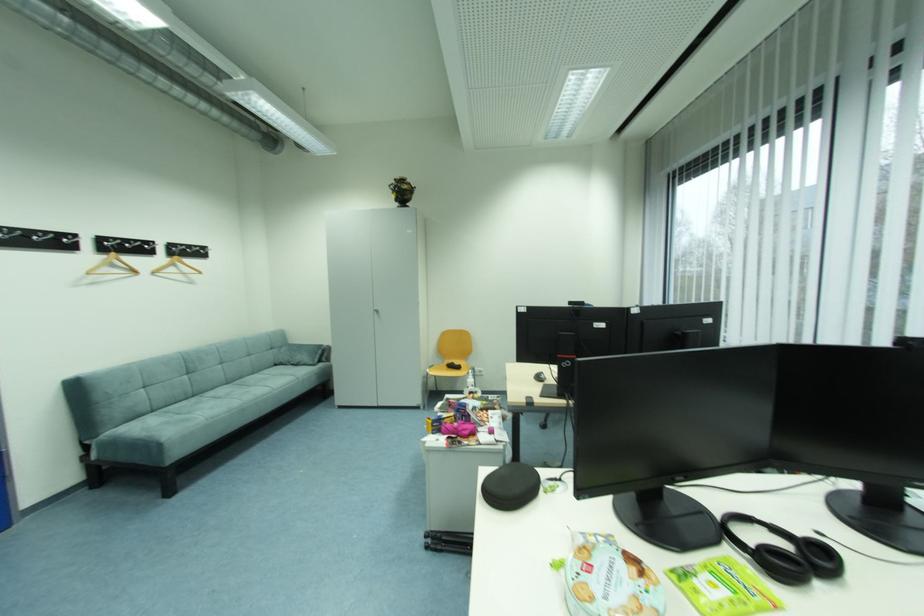
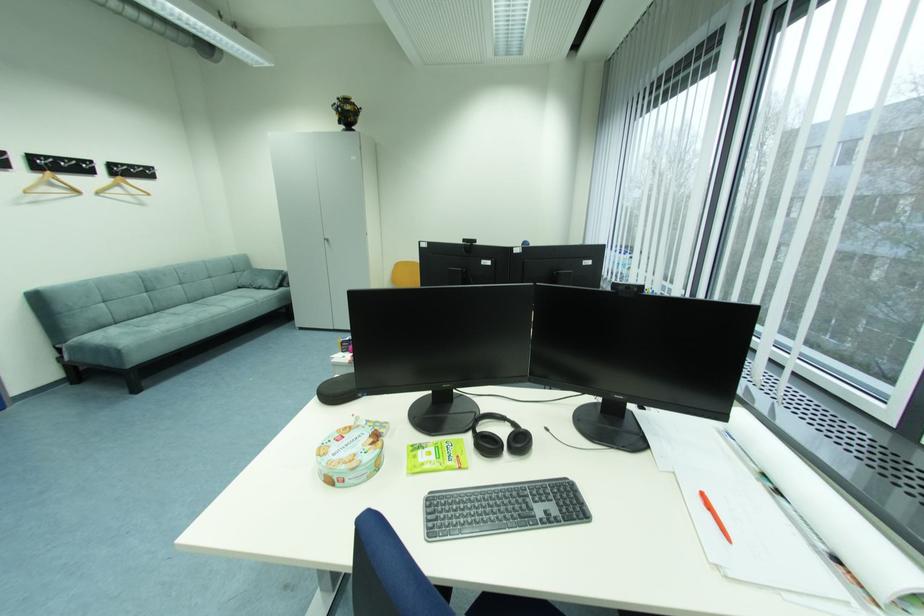
Where in the second image is the point corresponding to the point at 399,183 from the first image?

(344, 103)